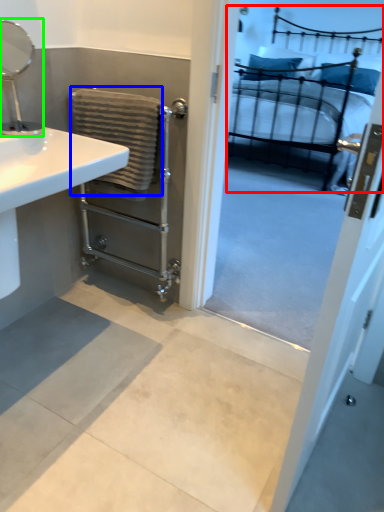
Question: Estimate the real-world distances between objects in this image. Which object is farther from bed (highlighted by a red box), bath towel (highlighted by a blue box) or mirror (highlighted by a green box)?

Choices:
 (A) bath towel
 (B) mirror

Answer: (B)